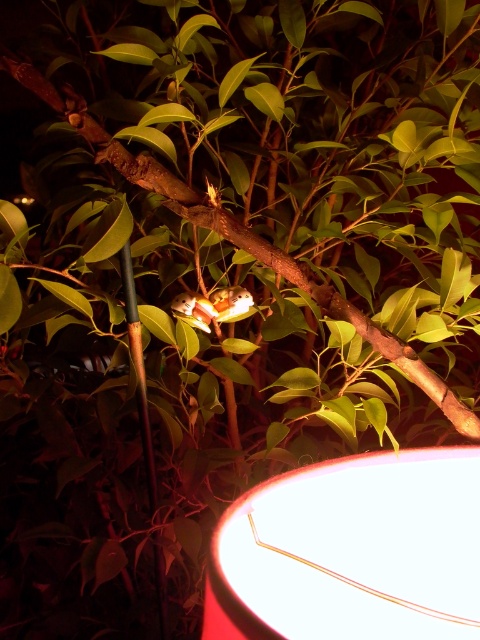
You are an artist trying to sketch the scene. You need to decide whether to draw the white glossy lampshade at lower right and the green bamboo pole at left with the same width. Based on the image, should you make them the same width or different widths?

The white glossy lampshade at lower right might be wider than green bamboo pole at left, so you should draw them with different widths.

You are standing in the nighttime scene with the tree and the mice figures. You need to place a new decorative item between the white glossy lampshade at lower right and the green bamboo pole at left. Which object should the item be placed closer to if it needs to be closer to the taller object?

The green bamboo pole at left is taller than the white glossy lampshade at lower right, so the item should be placed closer to the green bamboo pole at left.

You are an artist trying to sketch the scene. You need to decide which object to draw first based on size. Which one should you start with, the white glossy lampshade at lower right or the green bamboo pole at left?

The white glossy lampshade at lower right is bigger than the green bamboo pole at left, so you should start with the white glossy lampshade at lower right to ensure proper scaling in your sketch.